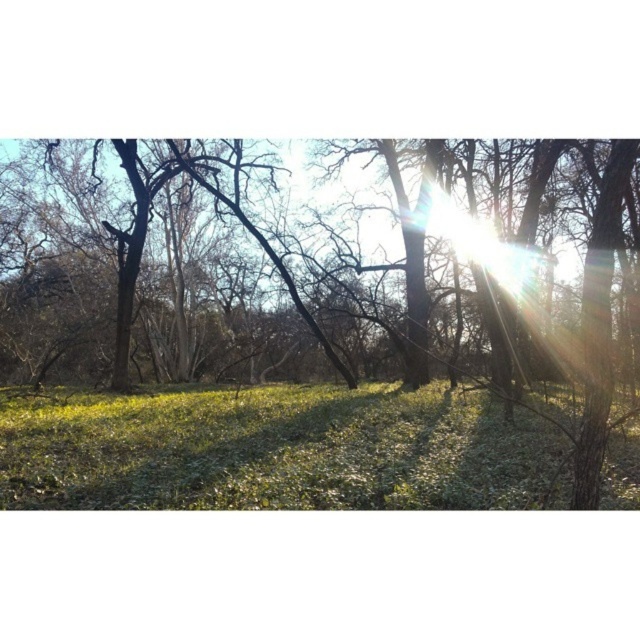
Question: Is the position of green leafy tree at center more distant than that of green matte grass at center?

Choices:
 (A) no
 (B) yes

Answer: (A)

Question: Is green leafy tree at center below green matte grass at center?

Choices:
 (A) yes
 (B) no

Answer: (B)

Question: Which of the following is the farthest from the observer?

Choices:
 (A) (308, 406)
 (B) (282, 227)

Answer: (B)

Question: Which point is closer to the camera taking this photo?

Choices:
 (A) (412, 452)
 (B) (445, 412)

Answer: (A)

Question: Does green leafy tree at center have a larger size compared to green matte grass at center?

Choices:
 (A) no
 (B) yes

Answer: (B)